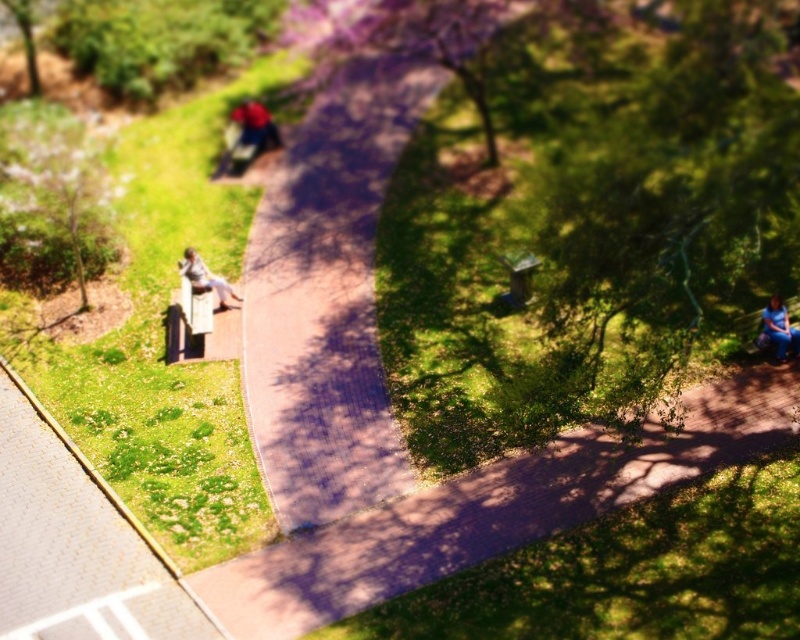
Does blue fabric person at lower right have a greater height compared to matte silver statue at center-left?

Yes.

Which is above, blue fabric person at lower right or matte silver statue at center-left?

matte silver statue at center-left

Which is behind, point (782, 320) or point (184, 259)?

Positioned behind is point (184, 259).

Identify the location of blue fabric person at lower right. (780, 330).

Which is more to the left, red fabric jacket at center or blue fabric person at lower right?

red fabric jacket at center is more to the left.

Can you confirm if red fabric jacket at center is wider than blue fabric person at lower right?

Indeed, red fabric jacket at center has a greater width compared to blue fabric person at lower right.

Which is behind, point (245, 132) or point (788, 314)?

Point (245, 132)

Locate an element on the screen. The width and height of the screenshot is (800, 640). red fabric jacket at center is located at coordinates (256, 124).

Is purple brick path at center positioned behind wooden park bench at lower left?

No, it is not.

Is point (348, 451) farther from viewer compared to point (170, 339)?

That is False.

Which is in front, point (284, 394) or point (188, 358)?

Point (284, 394) is more forward.

You are a GUI agent. You are given a task and a screenshot of the screen. Output one action in this format:
    pyautogui.click(x=<x>, y=<y>)
    Task: Click on the purple brick path at center
    
    Given the screenshot: What is the action you would take?
    pyautogui.click(x=328, y=298)